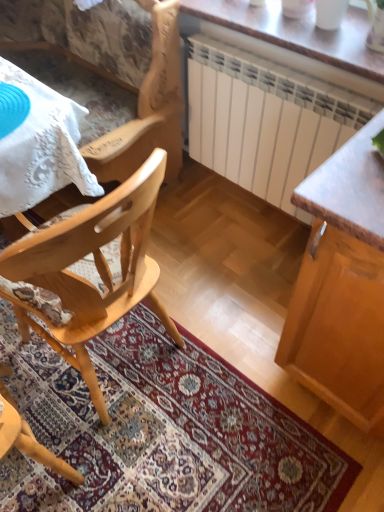
Identify the location of free location in front of natural wood chair at left, which is the 2th chair from top to bottom. Image resolution: width=384 pixels, height=512 pixels. (137, 449).